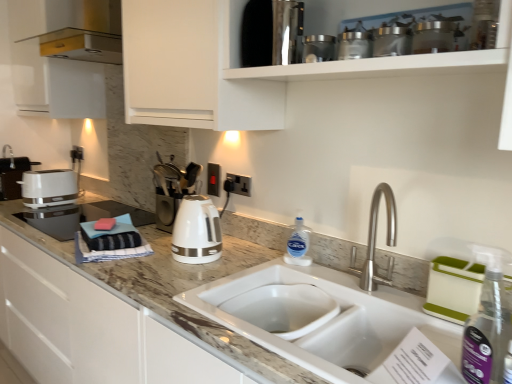
Identify the location of vacant area that lies between white glossy electric kettle at center and clear plastic bottle at sink, marked as the second bottle in a front-to-back arrangement. (248, 264).